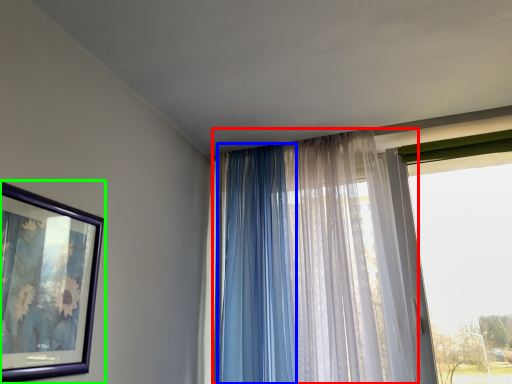
Question: Estimate the real-world distances between objects in this image. Which object is closer to curtain (highlighted by a red box), curtain (highlighted by a blue box) or picture frame (highlighted by a green box)?

Choices:
 (A) curtain
 (B) picture frame

Answer: (A)